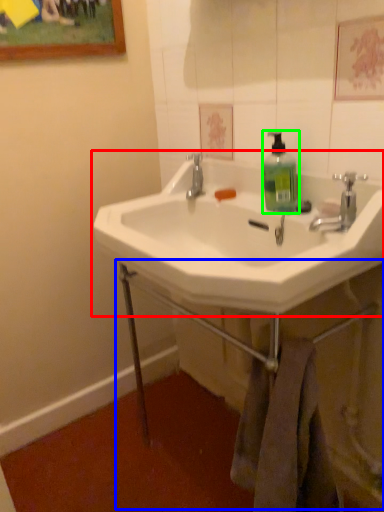
Question: Considering the real-world distances, which object is farthest from sink (highlighted by a red box)? counter (highlighted by a blue box) or soap dispenser (highlighted by a green box)?

Choices:
 (A) counter
 (B) soap dispenser

Answer: (A)